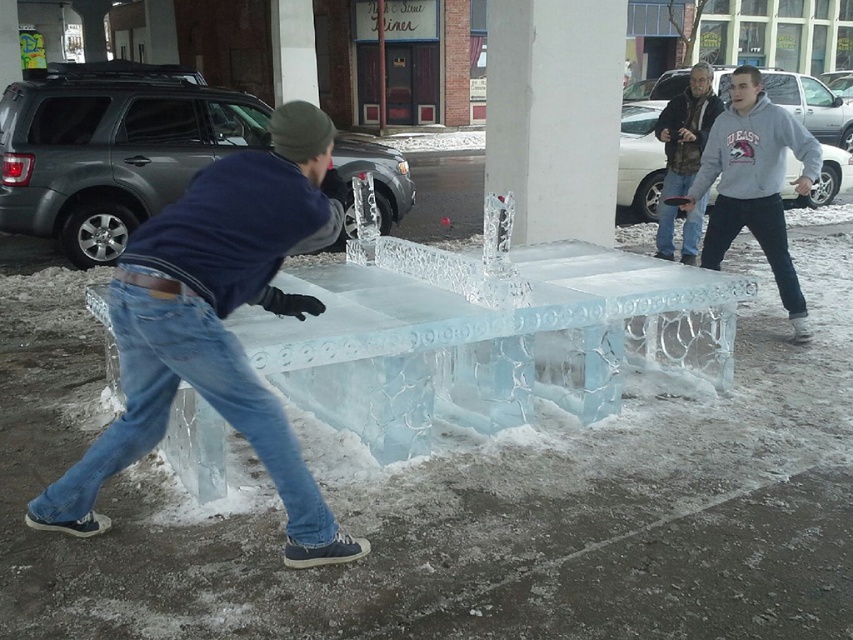
Can you confirm if white smooth concrete pillar at center is bigger than blue jeans at center?

Yes.

Who is more forward, (526, 125) or (689, 234)?

Positioned in front is point (526, 125).

Is point (621, 13) positioned behind point (671, 244)?

No, (621, 13) is closer to viewer.

Identify the location of white smooth concrete pillar at center. (554, 115).

How far apart are blue denim jeans at lower left and blue jeans at center?

blue denim jeans at lower left is 5.62 meters away from blue jeans at center.

Who is shorter, blue denim jeans at lower left or blue jeans at center?

blue denim jeans at lower left

Which is behind, point (103, 476) or point (691, 218)?

Point (691, 218)

This screenshot has width=853, height=640. Find the location of `blue denim jeans at lower left`. blue denim jeans at lower left is located at coordinates point(172,403).

Which is below, blue denim jeans at lower left or gray fleece sweatshirt at right?

Positioned lower is blue denim jeans at lower left.

Does point (120, 360) lie behind point (659, 125)?

No, it is in front of (659, 125).

Where is `blue denim jeans at lower left`? The width and height of the screenshot is (853, 640). blue denim jeans at lower left is located at coordinates (172, 403).